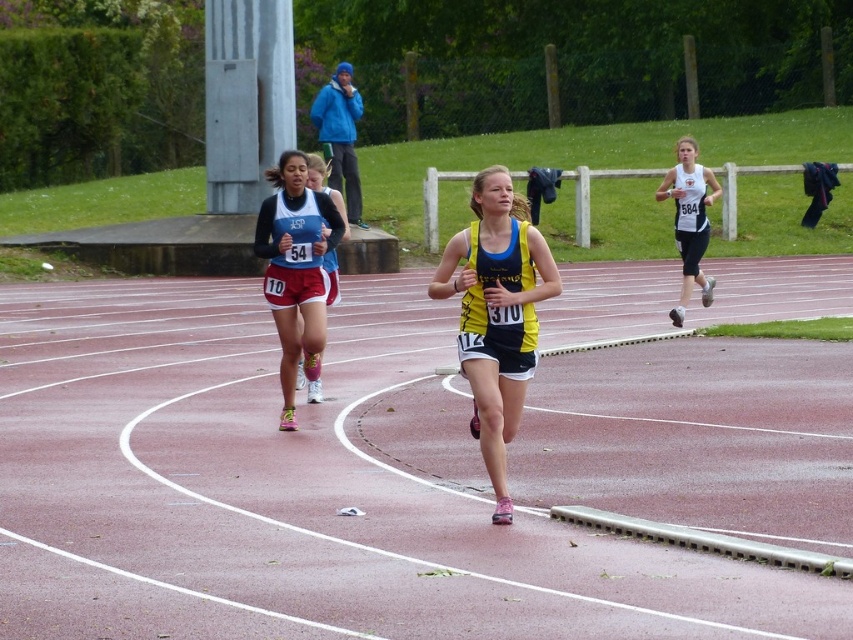
In the running event scene, you see the rubberized red track at center and the yellow fabric tank top at center. Which object takes up more space in the image?

The rubberized red track at center is bigger than the yellow fabric tank top at center, so it takes up more space in the image.

You are a photographer positioned at the starting line of the running event. You need to capture a photo where both the matte black shorts at center and the white athletic top at right are clearly visible. Considering their heights, which object should you focus on to ensure both are in frame?

The matte black shorts at center has a lesser height compared to white athletic top at right. To ensure both are in frame, focus on the white athletic top at right since it is taller, allowing the shorter matte black shorts at center to remain visible in the photo.

You are a spectator at the running event and want to know which clothing item is closer to you between the yellow fabric tank top at center and the matte black shorts at center. Based on the scene, which one is closer?

The yellow fabric tank top at center is closer to you because it is in front of the matte black shorts at center.